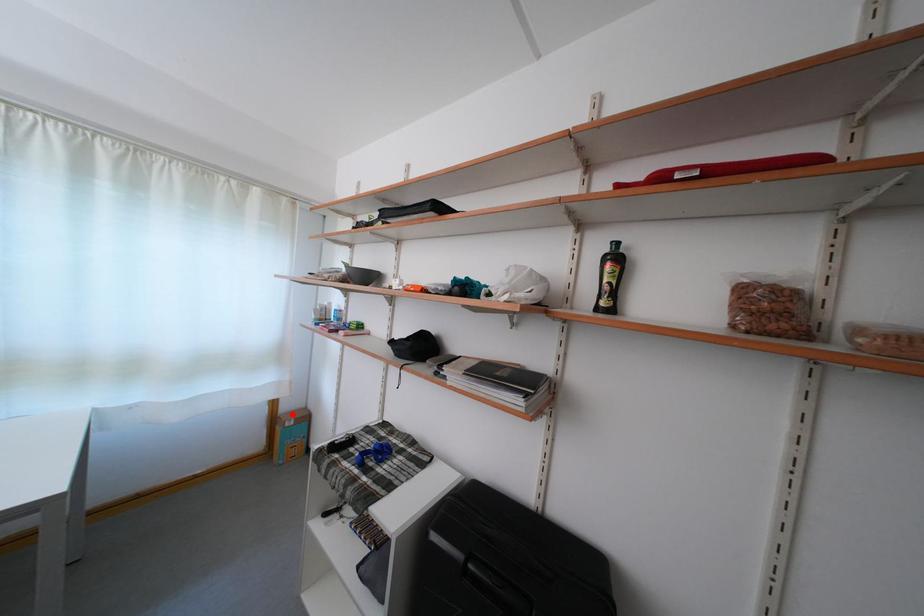
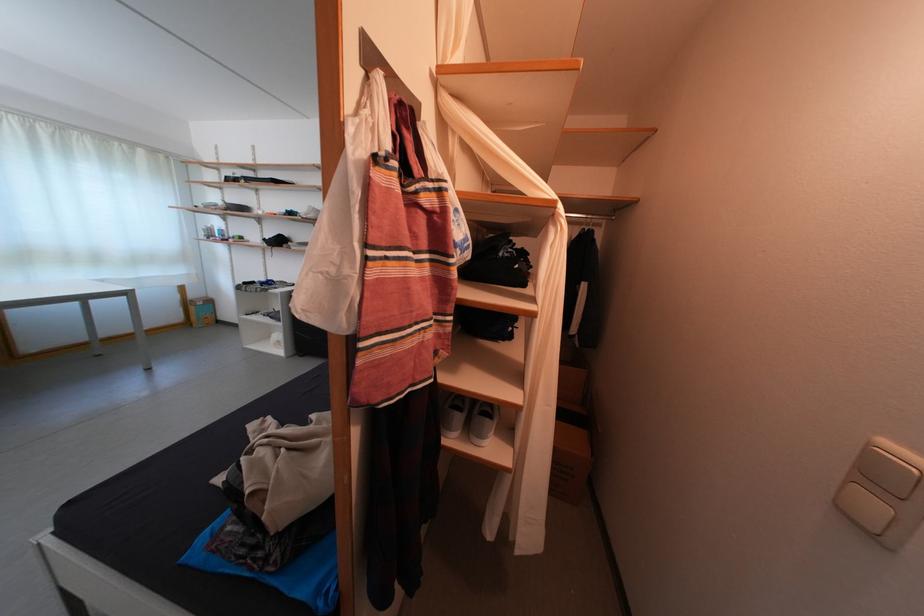
Question: I am providing you with two images of the same scene from different viewpoints. A red point is marked on the first image. Can you still see the location of the red point in image 2?

Choices:
 (A) Yes
 (B) No

Answer: (A)